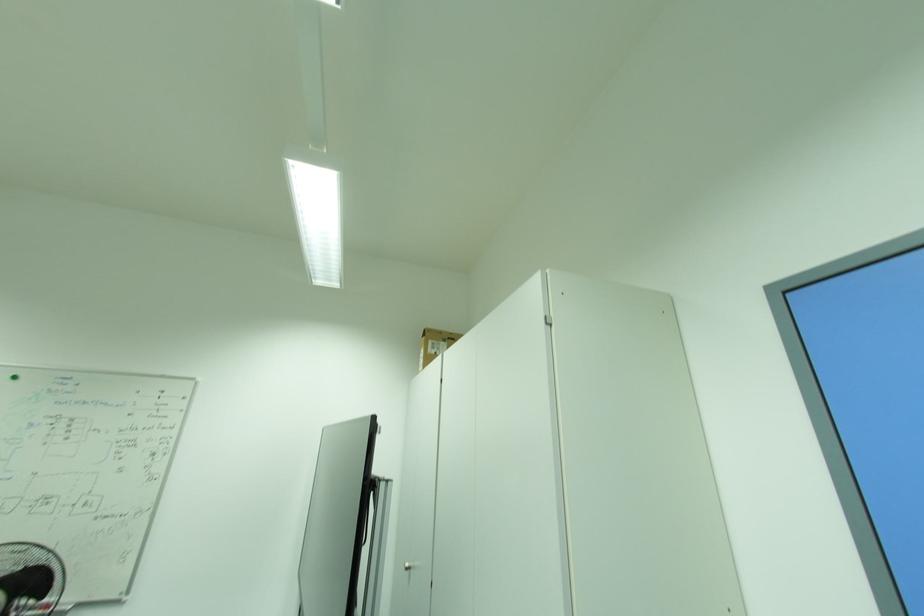
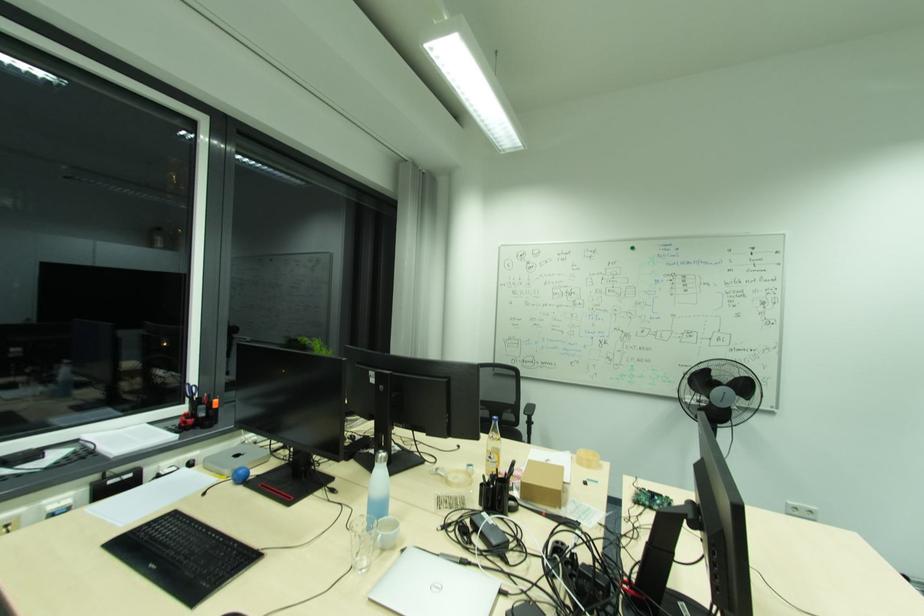
Locate, in the second image, the point that corresponds to (39,582) in the first image.

(748, 387)